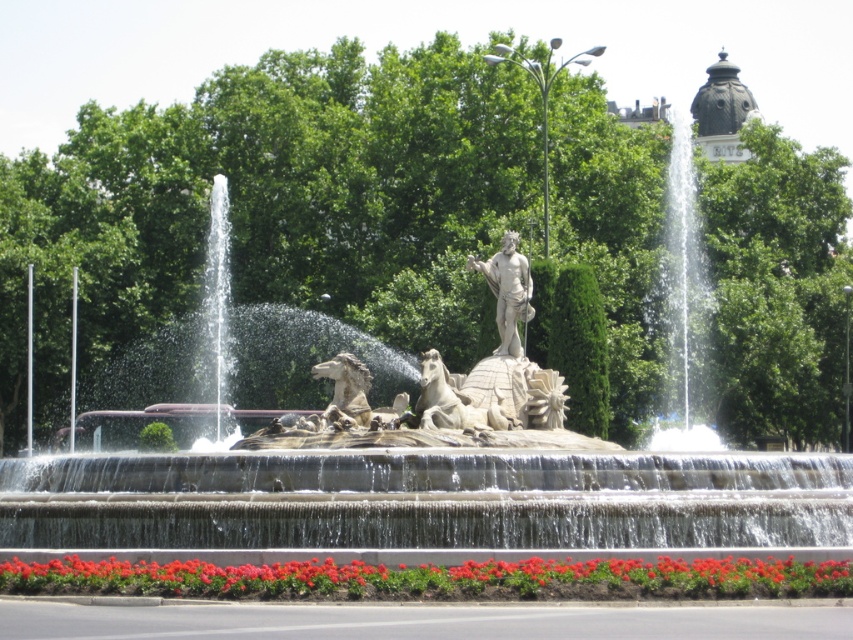
You are standing at the center of the public square. You want to move towards the stone fountain at center. Which direction should you walk?

The stone fountain at center is located at coordinates approximately 0.781 on the x axis and 0.501 on the y axis. Since you are at the center of the square, which would be the point where x and y are both 0.5, you should walk towards the right to reach the stone fountain at center.

You are standing in the public square and want to take a photo of the polished bronze statue at center. The statue is 68.07 meters away from you. Your camera has a maximum zoom range of 50 meters. Can you capture the entire statue in your photo without moving closer?

The polished bronze statue at center is 68.07 meters away, which exceeds your camera maximum zoom range of 50 meters. Therefore, you cannot capture the entire statue in your photo without moving closer.

You are a landscape architect designing a new garden path that needs to pass between the red glossy flowers at lower center and the polished stone horse at center. The path must be at least 10 feet wide to accommodate visitors. Based on the distance between these two objects, can the path be safely constructed without encroaching on either object?

The red glossy flowers at lower center and the polished stone horse at center are 77.00 feet apart. A 10 feet wide path can easily be constructed between them as the distance is more than sufficient to allow for the required width while maintaining a safe distance from both objects.